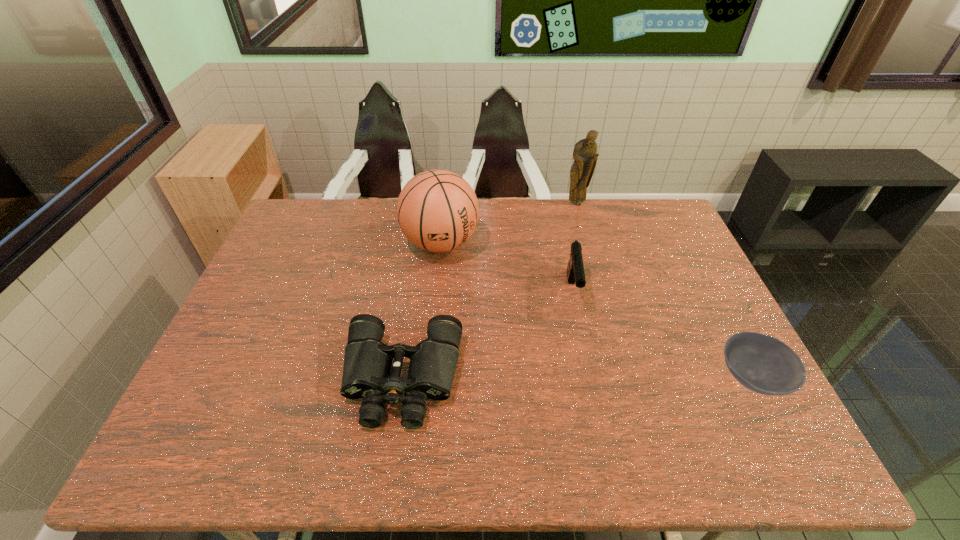
The width and height of the screenshot is (960, 540). Identify the location of vacant space at the far right corner. (679, 231).

Locate an element on the screen. vacant point located between the bowl and the second farthest object is located at coordinates (596, 310).

Locate an element on the screen. This screenshot has height=540, width=960. free spot between the basketball and the farthest object is located at coordinates (509, 224).

Find the location of a particular element. The image size is (960, 540). vacant area that lies between the bowl and the third shortest object is located at coordinates (661, 335).

At what (x,y) coordinates should I click in order to perform the action: click on vacant area that lies between the basketball and the rightmost object. Please return your answer as a coordinate pair (x, y). Looking at the image, I should click on (596, 310).

Find the location of a particular element. vacant area between the binoculars and the rightmost object is located at coordinates (577, 379).

Where is `free spot between the shortest object and the pistol`? The height and width of the screenshot is (540, 960). free spot between the shortest object and the pistol is located at coordinates (661, 335).

The width and height of the screenshot is (960, 540). Identify the location of unoccupied position between the second object from right to left and the fourth tallest object. (490, 292).

Find the location of a particular element. free point between the rightmost object and the farthest object is located at coordinates (664, 292).

Locate an element on the screen. Image resolution: width=960 pixels, height=540 pixels. free space between the shortest object and the second object from right to left is located at coordinates (664, 292).